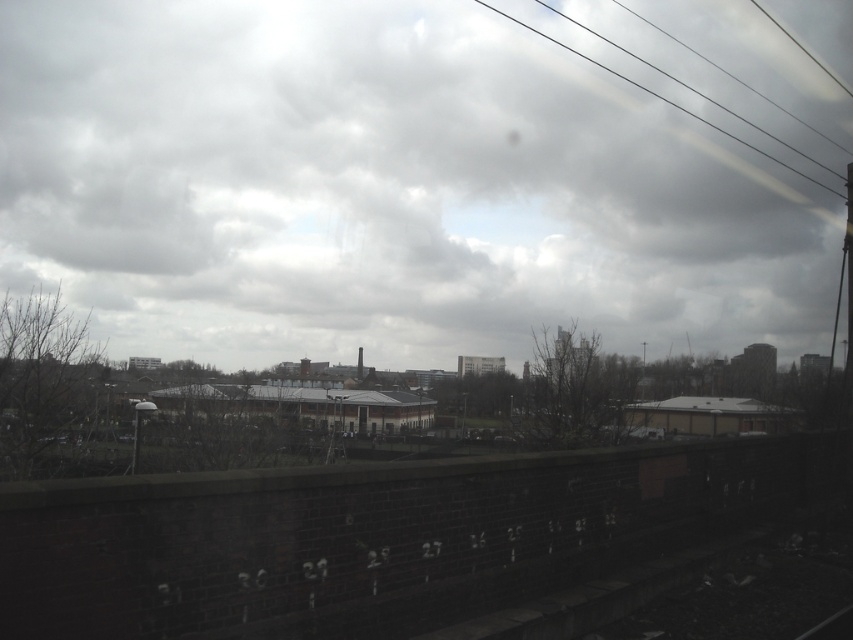
Is point (328, 157) positioned before point (804, 173)?

Yes.

Does cloudy sky at upper center have a greater height compared to smooth wire at upper right?

Correct, cloudy sky at upper center is much taller as smooth wire at upper right.

Which is in front, point (283, 296) or point (485, 4)?

Positioned in front is point (283, 296).

Identify the location of cloudy sky at upper center. (381, 189).